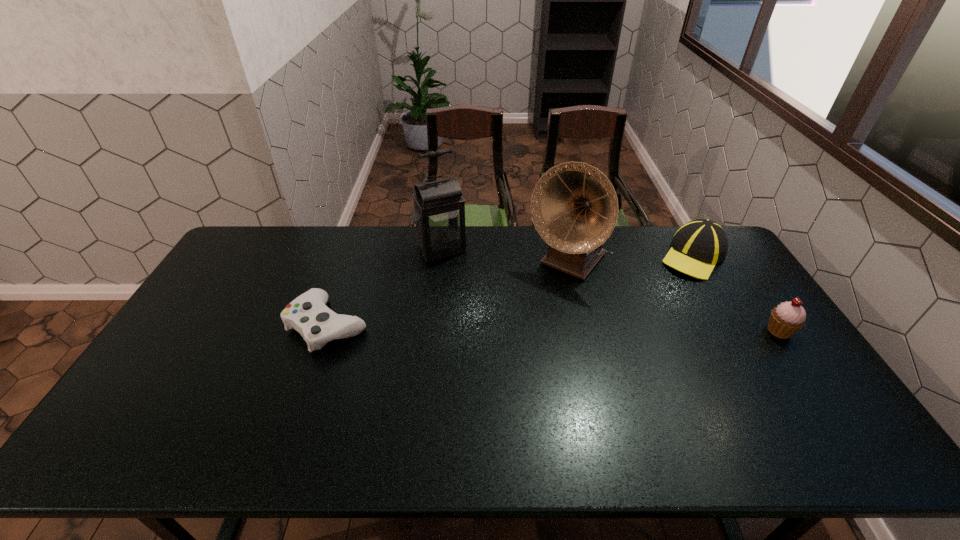
What are the coordinates of `vacant space on the desktop that is between the leftmost object and the cupcake and is positioned on the front-facing side of the fourth object from right to left` in the screenshot? It's located at (488, 327).

You are a GUI agent. You are given a task and a screenshot of the screen. Output one action in this format:
    pyautogui.click(x=<x>, y=<y>)
    Task: Click on the vacant space on the desktop that is between the shortest object and the cupcake and is positioned with the brim of the baseball cap facing forward
    The image size is (960, 540).
    Given the screenshot: What is the action you would take?
    pyautogui.click(x=598, y=328)

You are a GUI agent. You are given a task and a screenshot of the screen. Output one action in this format:
    pyautogui.click(x=<x>, y=<y>)
    Task: Click on the free space on the desktop that is between the leftmost object and the cupcake and is positioned on the horn of the third object from left to right
    
    Given the screenshot: What is the action you would take?
    pyautogui.click(x=511, y=327)